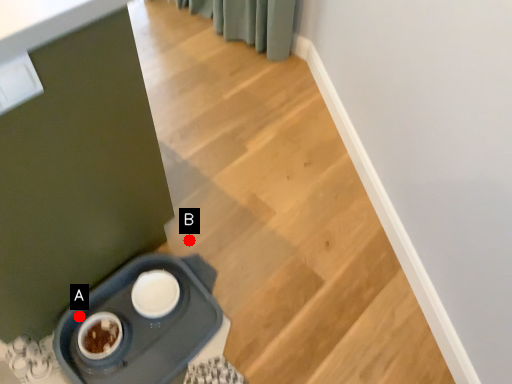
Question: Two points are circled on the image, labeled by A and B beside each circle. Which point appears closest to the camera in this image?

Choices:
 (A) A is closer
 (B) B is closer

Answer: (A)